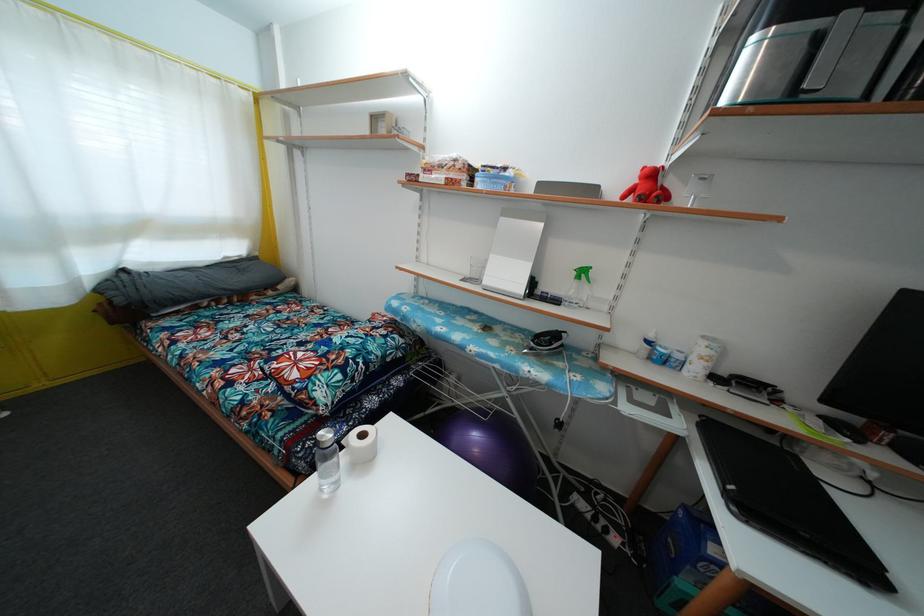
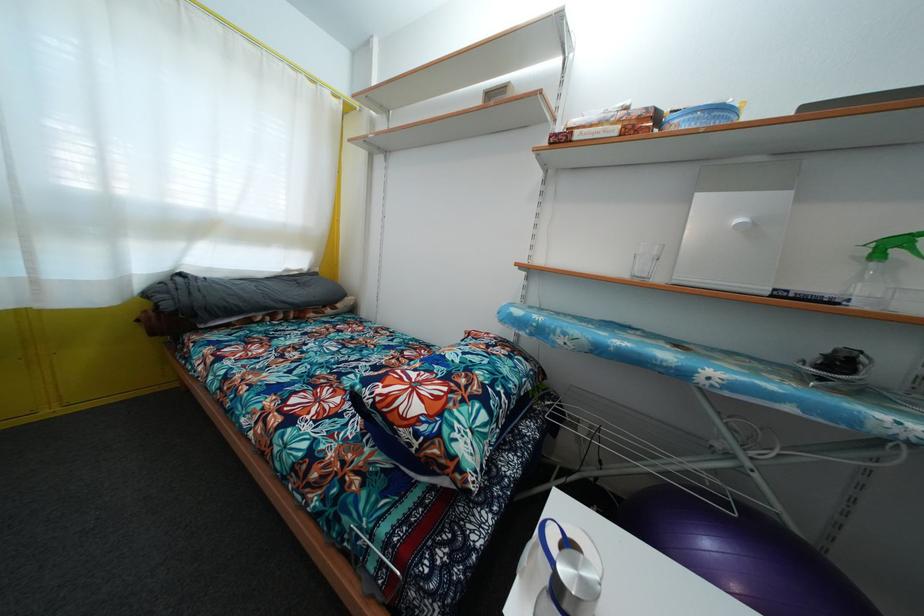
Question: Based on the continuous images, in which direction is the camera rotating? Reply with the corresponding letter.

Choices:
 (A) Left
 (B) Right
 (C) Up
 (D) Down

Answer: (C)